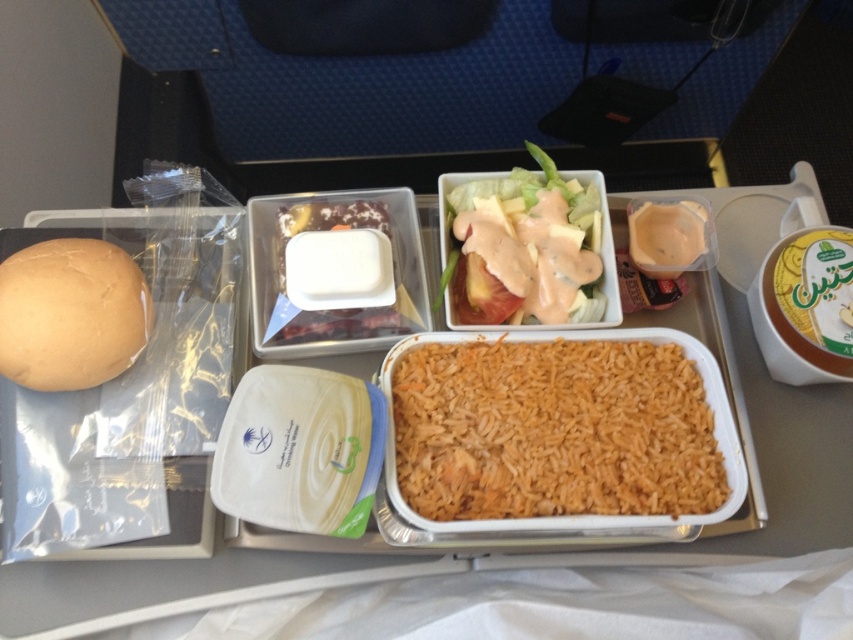
Looking at this image, you are a flight attendant checking the spacing between the matte plastic salad at center and the golden matte bun at left on the tray. The airline requires at least 12 inches between these items for safety. Is the current distance compliant?

The distance between the matte plastic salad at center and the golden matte bun at left is 16.28 inches, which exceeds the required 12 inches, so it is compliant.

You are a passenger on an airplane and want to eat your meal. You notice the golden matte bun at left and the matte plastic salad at center. Which item is closer to you on the tray table?

The golden matte bun at left is behind the matte plastic salad at center, so the matte plastic salad at center is closer to you.

You are a passenger on an airplane and want to eat your meal. You have the brown matte rice at center and the matte plastic salad at center in front of you. Which item is positioned lower on the tray table?

The brown matte rice at center is located below the matte plastic salad at center, so it is positioned lower on the tray table.